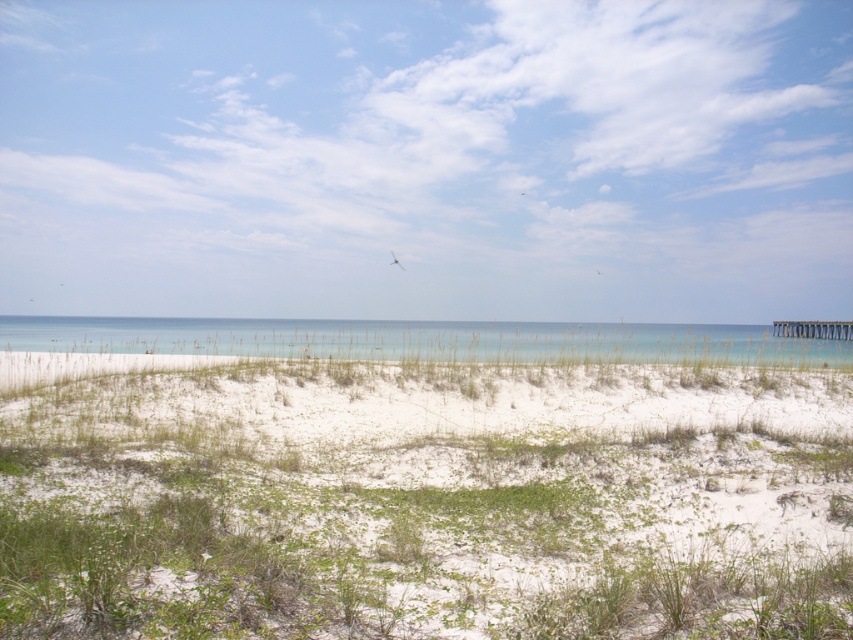
You are standing on the beach and want to take a photo of the white sand dunes at center. Which direction should you face to ensure the dunes are in the center of your camera view?

You should face towards the center of the scene to capture the white sand dunes at center, as they are located at the central point marked by coordinates.

You are standing on the beach and see the white sand dunes at center and the clear blue water at center. Which object is closer to the horizon?

The clear blue water at center is closer to the horizon because it is positioned above the white sand dunes at center.

You are a hiker who wants to cross from the white sand dunes at center to the clear blue water at center. Given that your hiking boots have a maximum stride of 3 feet, how many steps will you need to take to reach the water?

The distance between the white sand dunes at center and the clear blue water at center is 54.43 feet. Since your stride is 3 feet per step, you would need approximately 18 steps to cover the distance. However, since 3 multiplied by 18 equals 54, you might need an additional step to fully cover the 54.43 feet, totaling 19 steps.